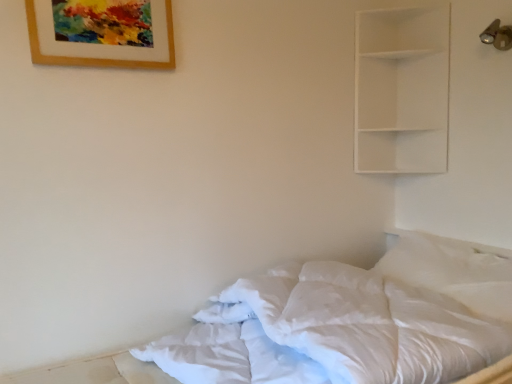
Question: From a real-world perspective, is white matte shelf at upper right located beneath wooden picture frame at upper left?

Choices:
 (A) yes
 (B) no

Answer: (A)

Question: Is white matte shelf at upper right far away from wooden picture frame at upper left?

Choices:
 (A) yes
 (B) no

Answer: (A)

Question: Considering the relative sizes of white matte shelf at upper right and wooden picture frame at upper left in the image provided, is white matte shelf at upper right wider than wooden picture frame at upper left?

Choices:
 (A) yes
 (B) no

Answer: (A)

Question: Is white matte shelf at upper right shorter than wooden picture frame at upper left?

Choices:
 (A) no
 (B) yes

Answer: (A)

Question: Are white matte shelf at upper right and wooden picture frame at upper left making contact?

Choices:
 (A) yes
 (B) no

Answer: (B)

Question: From a real-world perspective, is white matte shelf at upper right over wooden picture frame at upper left?

Choices:
 (A) no
 (B) yes

Answer: (A)

Question: Considering the relative positions of white soft bed at lower right and white matte shelf at upper right in the image provided, is white soft bed at lower right to the left of white matte shelf at upper right from the viewer's perspective?

Choices:
 (A) no
 (B) yes

Answer: (B)

Question: Is white matte shelf at upper right inside white soft bed at lower right?

Choices:
 (A) no
 (B) yes

Answer: (A)

Question: Does white soft bed at lower right come in front of white matte shelf at upper right?

Choices:
 (A) no
 (B) yes

Answer: (B)

Question: Is white soft bed at lower right facing away from white matte shelf at upper right?

Choices:
 (A) yes
 (B) no

Answer: (B)

Question: Can you confirm if white soft bed at lower right is bigger than white matte shelf at upper right?

Choices:
 (A) yes
 (B) no

Answer: (A)

Question: From the image's perspective, is white soft bed at lower right over white matte shelf at upper right?

Choices:
 (A) no
 (B) yes

Answer: (A)

Question: Is wooden picture frame at upper left far from white matte shelf at upper right?

Choices:
 (A) no
 (B) yes

Answer: (B)